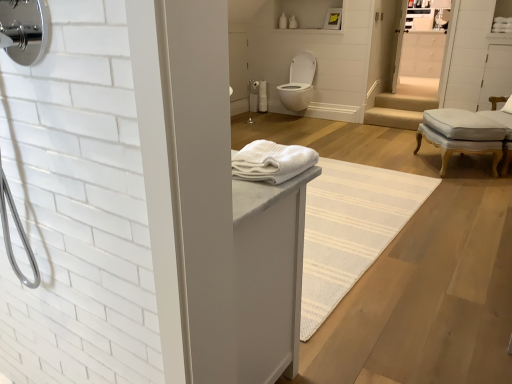
Describe the element at coordinates (252, 95) in the screenshot. I see `matte white shower at center` at that location.

Measure the distance between point (249,92) and camera.

6.29 meters.

The image size is (512, 384). What do you see at coordinates (422, 54) in the screenshot?
I see `white matte cabinet at upper right` at bounding box center [422, 54].

At what (x,y) coordinates should I click in order to perform the action: click on white matte cabinet at upper right. Please return your answer as a coordinate pair (x, y). Looking at the image, I should click on (422, 54).

What do you see at coordinates (298, 83) in the screenshot? I see `white glossy toilet at center` at bounding box center [298, 83].

In order to click on white soft towel at center in this screenshot , I will do `click(271, 162)`.

Find the location of a particular element. The image size is (512, 384). matte white shower at center is located at coordinates (252, 95).

Which of these two, white soft towel at center or white matte cabinet at upper right, is bigger?

white matte cabinet at upper right.

Is white soft towel at center inside or outside of white matte cabinet at upper right?

white soft towel at center cannot be found inside white matte cabinet at upper right.

From the image's perspective, is white soft towel at center located beneath white matte cabinet at upper right?

Indeed, from the image's perspective, white soft towel at center is shown beneath white matte cabinet at upper right.

Considering the points (297, 156) and (422, 76), which point is in front, point (297, 156) or point (422, 76)?

The point (297, 156) is more forward.

Considering the positions of points (464, 122) and (424, 73), is point (464, 122) closer to camera compared to point (424, 73)?

Yes, it is.

From a real-world perspective, is light gray fabric ottoman at right positioned above or below white matte cabinet at upper right?

light gray fabric ottoman at right is situated lower than white matte cabinet at upper right in the real world.

Is light gray fabric ottoman at right far away from white matte cabinet at upper right?

That's right, there is a large distance between light gray fabric ottoman at right and white matte cabinet at upper right.

Does light gray fabric ottoman at right come in front of white matte cabinet at upper right?

Yes, the depth of light gray fabric ottoman at right is less than that of white matte cabinet at upper right.

How distant is matte white shower at center from white glossy toilet at center?

They are 68.15 centimeters apart.

Is matte white shower at center far from white glossy toilet at center?

They are positioned close to each other.

Is matte white shower at center facing towards white glossy toilet at center?

No, matte white shower at center is not oriented towards white glossy toilet at center.

Considering the relative positions of light gray fabric ottoman at right and white glossy toilet at center in the image provided, is light gray fabric ottoman at right to the right of white glossy toilet at center from the viewer's perspective?

Correct, you'll find light gray fabric ottoman at right to the right of white glossy toilet at center.

Can you confirm if light gray fabric ottoman at right is taller than white glossy toilet at center?

In fact, light gray fabric ottoman at right may be shorter than white glossy toilet at center.

Between light gray fabric ottoman at right and white glossy toilet at center, which one has larger size?

light gray fabric ottoman at right is bigger.

From a real-world perspective, is white matte cabinet at upper right physically located above or below white glossy toilet at center?

white matte cabinet at upper right is situated higher than white glossy toilet at center in the real world.

Is white matte cabinet at upper right looking in the opposite direction of white glossy toilet at center?

white matte cabinet at upper right is not turned away from white glossy toilet at center.

Can you confirm if white matte cabinet at upper right is positioned to the right of white glossy toilet at center?

Yes, white matte cabinet at upper right is to the right of white glossy toilet at center.

The width and height of the screenshot is (512, 384). What are the coordinates of `bath towel located on the left of white matte cabinet at upper right` in the screenshot? It's located at (271, 162).

Does white matte cabinet at upper right have a lesser height compared to white soft towel at center?

No, white matte cabinet at upper right is not shorter than white soft towel at center.

Are white matte cabinet at upper right and white soft towel at center located far from each other?

Indeed, white matte cabinet at upper right is not near white soft towel at center.

From the image's perspective, is white matte cabinet at upper right on top of white soft towel at center?

Correct, white matte cabinet at upper right appears higher than white soft towel at center in the image.

Would you say white soft towel at center is inside or outside light gray fabric ottoman at right?

white soft towel at center exists outside the volume of light gray fabric ottoman at right.

Is point (261, 174) closer to camera compared to point (479, 152)?

That is True.

Which is more to the right, white soft towel at center or light gray fabric ottoman at right?

→ light gray fabric ottoman at right.

From a real-world perspective, is white soft towel at center beneath light gray fabric ottoman at right?

Incorrect, from a real-world perspective, white soft towel at center is higher than light gray fabric ottoman at right.

Find the location of a particular element. This screenshot has width=512, height=384. bath towel in front of the white matte cabinet at upper right is located at coordinates 271,162.

The image size is (512, 384). What are the coordinates of `cabinetry positioned vertically above the light gray fabric ottoman at right (from a real-world perspective)` in the screenshot? It's located at (422, 54).

From the image, which object appears to be farther from matte white shower at center, white soft towel at center or white glossy toilet at center?

white soft towel at center is further to matte white shower at center.

Considering their positions, is white glossy toilet at center positioned closer to white soft towel at center than white matte cabinet at upper right?

white glossy toilet at center is positioned closer to the anchor white soft towel at center.

When comparing their distances from light gray fabric ottoman at right, does white glossy toilet at center or white soft towel at center seem closer?

white glossy toilet at center lies closer to light gray fabric ottoman at right than the other object.

Which object lies nearer to the anchor point light gray fabric ottoman at right, white soft towel at center or white glossy toilet at center?

white glossy toilet at center.

Based on their spatial positions, is white matte cabinet at upper right or white glossy toilet at center closer to white soft towel at center?

Among the two, white glossy toilet at center is located nearer to white soft towel at center.

From the image, which object appears to be nearer to white soft towel at center, white matte cabinet at upper right or matte white shower at center?

white matte cabinet at upper right is positioned closer to the anchor white soft towel at center.

From the image, which object appears to be farther from white soft towel at center, light gray fabric ottoman at right or white matte cabinet at upper right?

white matte cabinet at upper right is further to white soft towel at center.

Estimate the real-world distances between objects in this image. Which object is closer to white matte cabinet at upper right, white soft towel at center or light gray fabric ottoman at right?

Among the two, light gray fabric ottoman at right is located nearer to white matte cabinet at upper right.

Locate an element on the screen. chair between white soft towel at center and white glossy toilet at center in the front-back direction is located at coordinates (462, 134).

I want to click on shower positioned between white soft towel at center and white matte cabinet at upper right from near to far, so click(252, 95).

Image resolution: width=512 pixels, height=384 pixels. I want to click on toilet between white soft towel at center and white matte cabinet at upper right from front to back, so click(298, 83).

The width and height of the screenshot is (512, 384). I want to click on shower positioned between light gray fabric ottoman at right and white matte cabinet at upper right from near to far, so click(x=252, y=95).